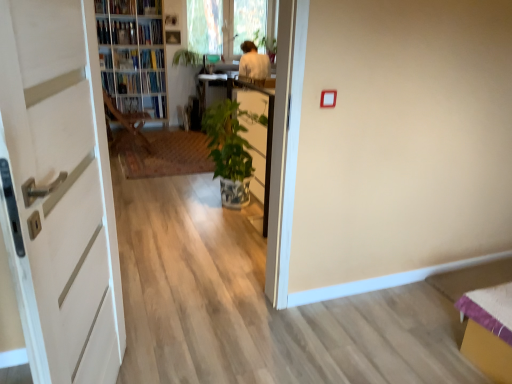
In order to face hardcover book at upper left, which ranks as the third book in right-to-left order, should I rotate leftwards or rightwards?

Rotate your view left by about 19.528°.

I want to click on wooden bookshelf at upper left, so click(x=135, y=54).

The image size is (512, 384). Describe the element at coordinates (257, 132) in the screenshot. I see `green glazed pot at center` at that location.

Find the location of a particular element. This screenshot has height=384, width=512. hardcover book at upper left, positioned as the 2th book in left-to-right order is located at coordinates (106, 60).

How different are the orientations of hardcover book at upper left, the 3th book from the left, and white matte door at left in degrees?

76.7 degrees separate the facing orientations of hardcover book at upper left, the 3th book from the left, and white matte door at left.

Considering the sizes of objects hardcover book at upper left, the 3th book from the left, and white matte door at left in the image provided, who is smaller, hardcover book at upper left, the 3th book from the left, or white matte door at left?

hardcover book at upper left, the 3th book from the left, is smaller.

Considering the sizes of hardcover book at upper left, the 3th book from the left, and white matte door at left in the image, is hardcover book at upper left, the 3th book from the left, wider or thinner than white matte door at left?

In the image, hardcover book at upper left, the 3th book from the left, appears to be wider than white matte door at left.

From the image's perspective, starting from the white matte door at left, which book is the 1st one above? Please provide its 2D coordinates.

[(128, 83)]

Does point (125, 87) appear closer or farther from the camera than point (275, 40)?

Point (125, 87).

Considering the relative sizes of hardcover book at upper left, the 3th book from the left, and green glossy plant at upper center in the image provided, is hardcover book at upper left, the 3th book from the left, taller than green glossy plant at upper center?

Incorrect, the height of hardcover book at upper left, the 3th book from the left, is not larger of that of green glossy plant at upper center.

Is there a large distance between hardcover book at upper left, the 3th book from the left, and green glossy plant at upper center?

Yes, hardcover book at upper left, the 3th book from the left, and green glossy plant at upper center are quite far apart.

Is green glossy plant at upper center located within hardcover book at upper left, the 3th book from the left?

No, hardcover book at upper left, the 3th book from the left, does not contain green glossy plant at upper center.

Is hardcover book at center, the fourth book from the left, taller than hardcover book at upper left, positioned as the 2th book in left-to-right order?

No, hardcover book at center, the fourth book from the left, is not taller than hardcover book at upper left, positioned as the 2th book in left-to-right order.

Looking at this image, is hardcover book at center, the fourth book from the left, aimed at hardcover book at upper left, positioned as the 2th book in left-to-right order?

No, hardcover book at center, the fourth book from the left, is not oriented towards hardcover book at upper left, positioned as the 2th book in left-to-right order.

Is hardcover book at center, which ranks as the 1th book in right-to-left order, with hardcover book at upper left, which ranks as the third book in right-to-left order?

No, hardcover book at center, which ranks as the 1th book in right-to-left order, is not in contact with hardcover book at upper left, which ranks as the third book in right-to-left order.

From the image's perspective, is hardcover book at center, the fourth book from the left, located above hardcover book at upper left, positioned as the 2th book in left-to-right order?

Incorrect, from the image's perspective, hardcover book at center, the fourth book from the left, is lower than hardcover book at upper left, positioned as the 2th book in left-to-right order.

In order to click on cabinetry below the hardcover book at upper left, positioned as the 2th book in left-to-right order (from the image's perspective) in this screenshot , I will do `click(257, 132)`.

Consider the image. Who is taller, hardcover book at upper left, which ranks as the third book in right-to-left order, or green glazed pot at center?

green glazed pot at center.

Is hardcover book at upper left, positioned as the 2th book in left-to-right order, closer to camera compared to green glazed pot at center?

No, hardcover book at upper left, positioned as the 2th book in left-to-right order, is further to the viewer.

Looking at this image, how much distance is there between hardcover book at upper left, which ranks as the third book in right-to-left order, and green glazed pot at center?

A distance of 9.99 feet exists between hardcover book at upper left, which ranks as the third book in right-to-left order, and green glazed pot at center.

Based on the photo, is hardcover book at upper left, which ranks as the third book in right-to-left order, smaller than green glossy plant at center?

Yes.

Identify the location of houseplant below the hardcover book at upper left, positioned as the 2th book in left-to-right order (from a real-world perspective). (230, 150).

Considering the relative sizes of hardcover book at upper left, which ranks as the third book in right-to-left order, and green glossy plant at center in the image provided, is hardcover book at upper left, which ranks as the third book in right-to-left order, shorter than green glossy plant at center?

Correct, hardcover book at upper left, which ranks as the third book in right-to-left order, is not as tall as green glossy plant at center.

Between hardcover book at upper left, positioned as the 2th book in left-to-right order, and green glossy plant at center, which one is positioned in front?

green glossy plant at center is closer to the camera.

Considering the positions of objects matte white book at upper left, the first book when ordered from left to right, and green glossy plant at upper center in the image provided, who is more to the right, matte white book at upper left, the first book when ordered from left to right, or green glossy plant at upper center?

From the viewer's perspective, green glossy plant at upper center appears more on the right side.

How many degrees apart are the facing directions of matte white book at upper left, the first book when ordered from left to right, and green glossy plant at upper center?

The angle between the facing direction of matte white book at upper left, the first book when ordered from left to right, and the facing direction of green glossy plant at upper center is 0.107 degrees.

Is matte white book at upper left, the first book when ordered from left to right, placed right next to green glossy plant at upper center?

No, matte white book at upper left, the first book when ordered from left to right, is not next to green glossy plant at upper center.

Is matte white book at upper left, acting as the 4th book starting from the right, closer to camera compared to green glossy plant at upper center?

Yes, it is.

Is wooden chair at center next to hardcover book at upper left, which ranks as the third book in right-to-left order, and touching it?

wooden chair at center is not next to hardcover book at upper left, which ranks as the third book in right-to-left order, and they're not touching.

Considering the sizes of wooden chair at center and hardcover book at upper left, positioned as the 2th book in left-to-right order, in the image, is wooden chair at center wider or thinner than hardcover book at upper left, positioned as the 2th book in left-to-right order,?

Clearly, wooden chair at center has more width compared to hardcover book at upper left, positioned as the 2th book in left-to-right order.

Is wooden chair at center not inside hardcover book at upper left, positioned as the 2th book in left-to-right order?

Yes.

The image size is (512, 384). Identify the location of the 1st book behind the wooden chair at center. (106, 60).

Where is `door located in front of the hardcover book at upper left, the 2th book viewed from the right`? The width and height of the screenshot is (512, 384). door located in front of the hardcover book at upper left, the 2th book viewed from the right is located at coordinates (59, 192).

From the image's perspective, which book is the 4th one below the green glossy plant at upper center? Please provide its 2D coordinates.

[(128, 83)]

Based on their spatial positions, is matte white book at upper left, acting as the 4th book starting from the right, or green glossy plant at upper center closer to hardcover book at center, the fourth book from the left?

matte white book at upper left, acting as the 4th book starting from the right.

Based on their spatial positions, is hardcover book at upper left, which ranks as the third book in right-to-left order, or wooden bookshelf at upper left further from green glossy plant at center?

hardcover book at upper left, which ranks as the third book in right-to-left order, is positioned further to the anchor green glossy plant at center.

Estimate the real-world distances between objects in this image. Which object is closer to green glazed pot at center, white matte door at left or hardcover book at center, the fourth book from the left?

white matte door at left lies closer to green glazed pot at center than the other object.

Considering their positions, is matte white book at upper left, acting as the 4th book starting from the right, positioned closer to white matte door at left than wooden bookshelf at upper left?

wooden bookshelf at upper left.

Which object lies nearer to the anchor point hardcover book at upper left, the 3th book from the left, hardcover book at center, which ranks as the 1th book in right-to-left order, or hardcover book at upper left, positioned as the 2th book in left-to-right order?

hardcover book at center, which ranks as the 1th book in right-to-left order, is closer to hardcover book at upper left, the 3th book from the left.

Which object lies nearer to the anchor point wooden chair at center, matte white book at upper left, the first book when ordered from left to right, or wooden bookshelf at upper left?

wooden bookshelf at upper left.

Considering their positions, is matte white book at upper left, acting as the 4th book starting from the right, positioned closer to wooden chair at center than hardcover book at center, the fourth book from the left?

matte white book at upper left, acting as the 4th book starting from the right.

When comparing their distances from hardcover book at upper left, the 2th book viewed from the right, does matte white book at upper left, the first book when ordered from left to right, or hardcover book at upper left, which ranks as the third book in right-to-left order, seem closer?

matte white book at upper left, the first book when ordered from left to right, is closer to hardcover book at upper left, the 2th book viewed from the right.

The image size is (512, 384). I want to click on houseplant positioned between white matte door at left and hardcover book at upper left, the 2th book viewed from the right, from near to far, so click(230, 150).

Where is `book between wooden chair at center and green glossy plant at upper center in the horizontal direction`? Image resolution: width=512 pixels, height=384 pixels. book between wooden chair at center and green glossy plant at upper center in the horizontal direction is located at coordinates (153, 82).

This screenshot has width=512, height=384. I want to click on shelf between green glazed pot at center and hardcover book at upper left, which ranks as the third book in right-to-left order, from front to back, so click(135, 54).

Locate an element on the screen. The height and width of the screenshot is (384, 512). shelf between wooden chair at center and hardcover book at upper left, positioned as the 2th book in left-to-right order, along the z-axis is located at coordinates (135, 54).